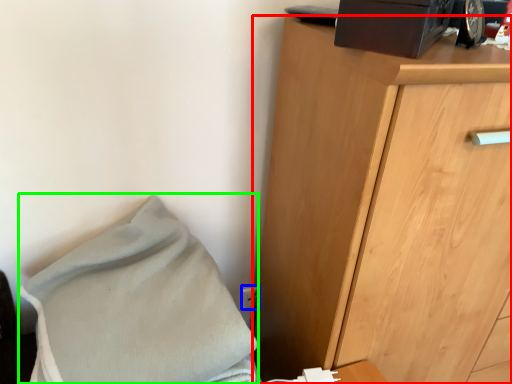
Question: Which object is the farthest from chest of drawers (highlighted by a red box)? Choose among these: electric outlet (highlighted by a blue box) or blanket (highlighted by a green box).

Choices:
 (A) electric outlet
 (B) blanket

Answer: (A)